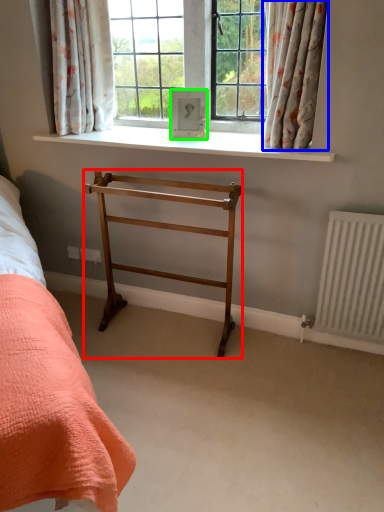
Question: Which object is positioned closest to furniture (highlighted by a red box)? Select from curtain (highlighted by a blue box) and picture frame (highlighted by a green box).

Choices:
 (A) curtain
 (B) picture frame

Answer: (B)